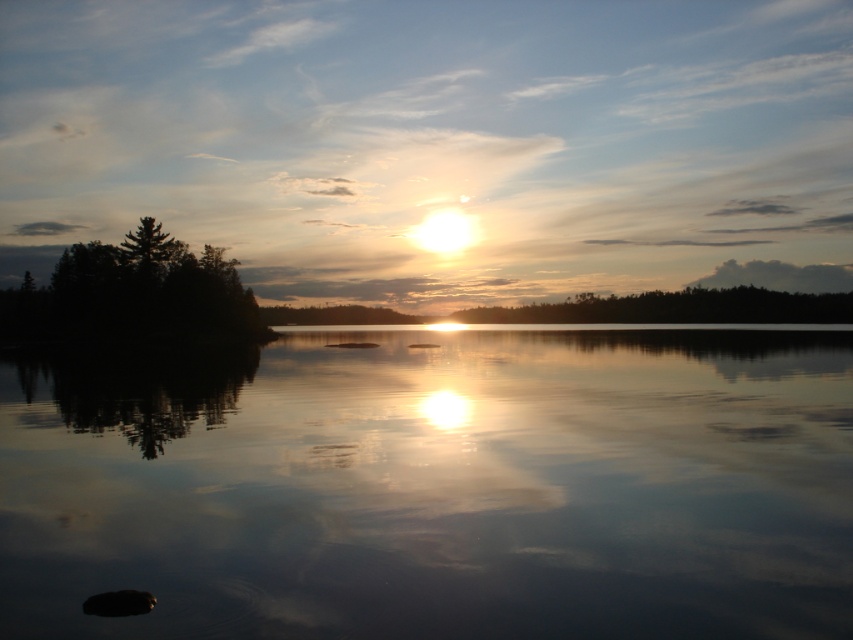
You are a photographer trying to capture the sunset reflection on the transparent water at center. However, you notice the dark green textured tree at left might block the view. Based on their positions, will the tree obstruct the reflection of the sunset on the water?

The transparent water at center is in front of dark green textured tree at left, so the tree is behind the water and will not obstruct the reflection of the sunset on the water.

You are standing on the lakeside and see the transparent water at center and the dark green textured tree at left. Which object is closer to the right edge of the image?

The transparent water at center is closer to the right edge of the image because it is to the right of the dark green textured tree at left.

You are an artist trying to paint the sunset scene. You want to ensure the transparent water at center and the dark green textured tree at left are proportionally accurate. Which object should you paint first to maintain the correct size relationship between them?

You should paint the dark green textured tree at left first because the transparent water at center is smaller than it, allowing you to establish the larger size reference first.